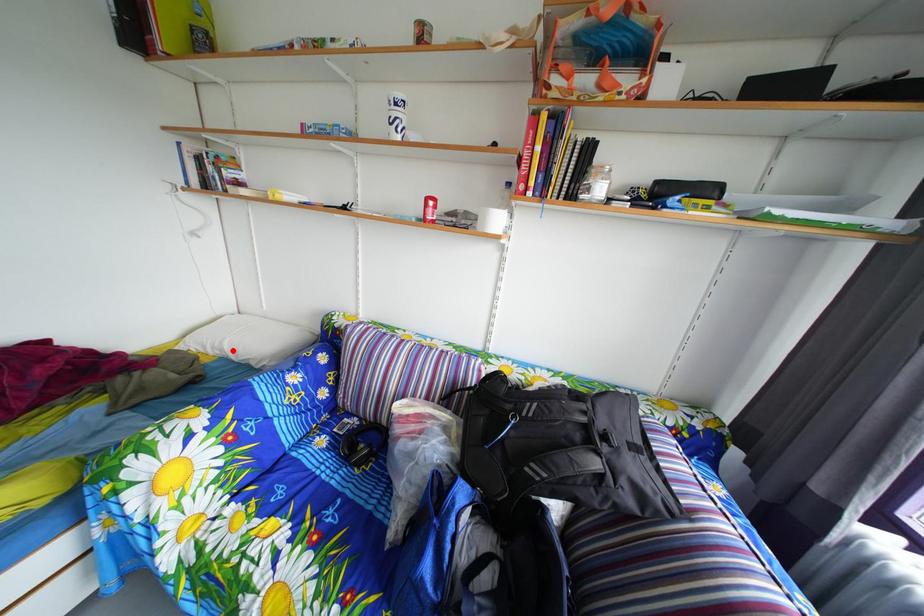
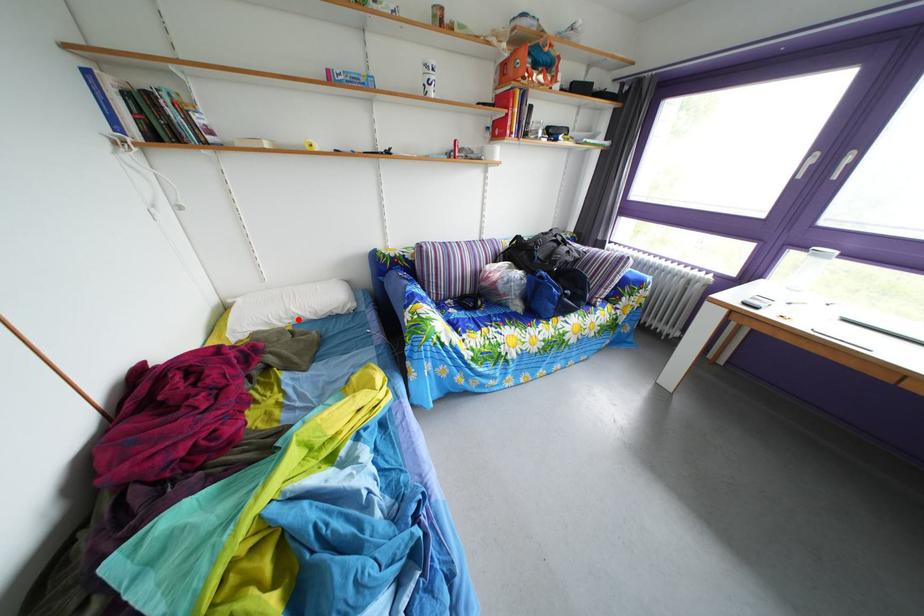
I am providing you with two images of the same scene from different viewpoints. A red point is marked on the first image and another point is marked on the second image. Are the points marked in image1 and image2 representing the same 3D position?

Yes